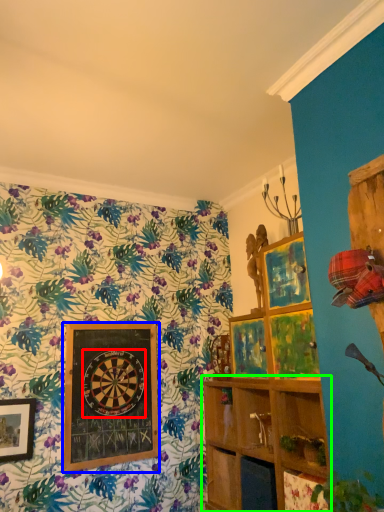
Question: Based on their relative distances, which object is nearer to design (highlighted by a red box)? Choose from picture frame (highlighted by a blue box) and shelf (highlighted by a green box).

Choices:
 (A) picture frame
 (B) shelf

Answer: (A)